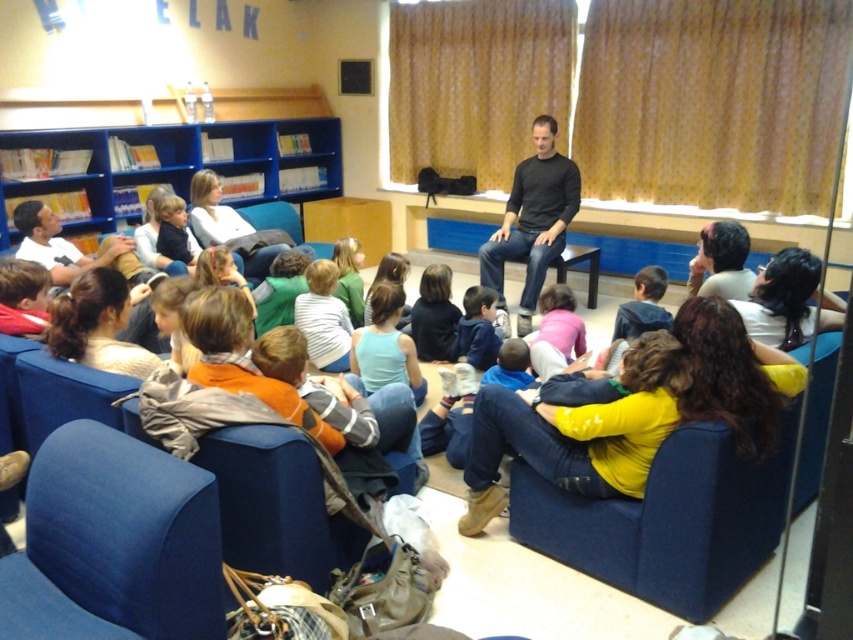
You are sitting in the blue fabric armchair at lower left and want to move to the matte blue armchair at lower right. Can you walk directly to it without moving around any other chairs?

The blue fabric armchair at lower left is in front of matte blue armchair at lower right, so you would need to move around the blue fabric armchair at lower left to reach the matte blue armchair at lower right. Therefore, you cannot walk directly to it without moving around other chairs.

You are attending a presentation in a library and notice two attendees wearing a matte white shirt at lower left and a striped cotton shirt at center. Which attendee is sitting closer to the front row?

The striped cotton shirt at center is sitting closer to the front row because the matte white shirt at lower left is above it, indicating a higher position in the image which corresponds to being further back in the seating arrangement.